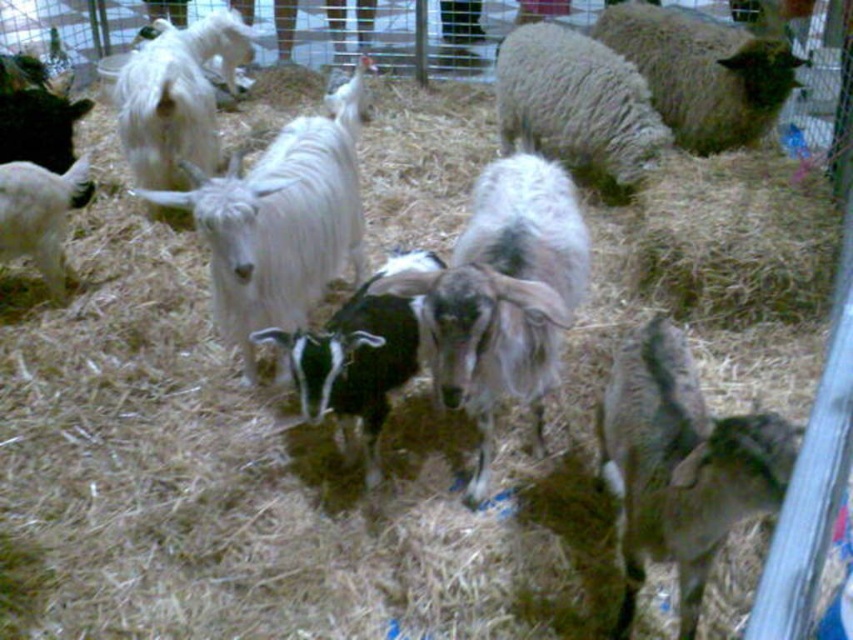
You are standing in front of the goat enclosure and want to touch the point at coordinate point (575, 256). Can you reach it without moving your position? Assume your arm can extend 1.8 meters.

The point at coordinate point (575, 256) is 2.26 meters away from the viewer, which is beyond the reach of your arm that can extend 1.8 meters. Therefore, you cannot reach it without moving.

You are a farmer checking the goats in the pen. You notice the dark brown woolen goat at lower right and the black and white fur at center. Which one is smaller?

The dark brown woolen goat at lower right is smaller than the black and white fur at center.